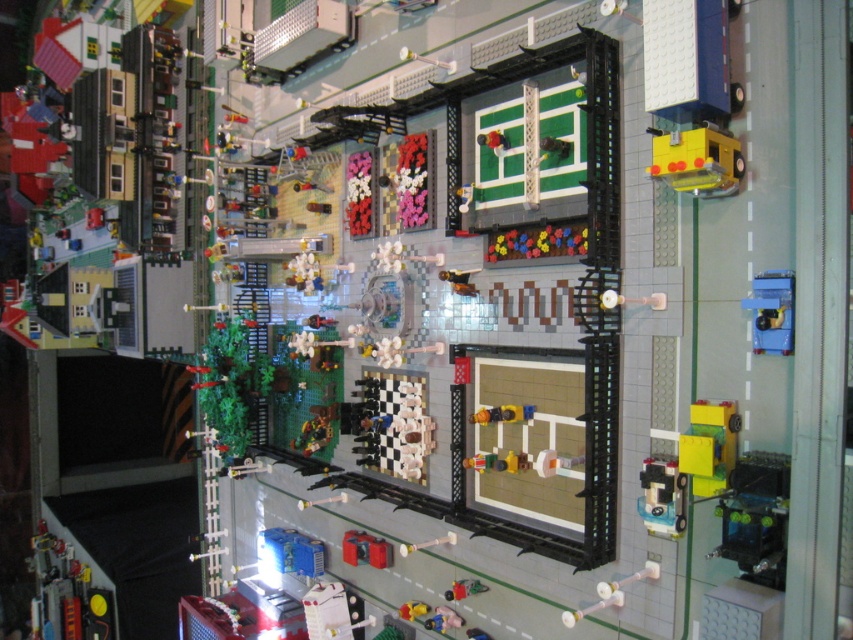
You are a Lego figure trying to reach the translucent plastic car at lower right from your current position near the yellow plastic figure at center. Considering their sizes, which object would you need to move first to create space?

Since the translucent plastic car at lower right is smaller than the yellow plastic figure at center, you should move the translucent plastic car at lower right first to create space because it is easier to move due to its smaller size.